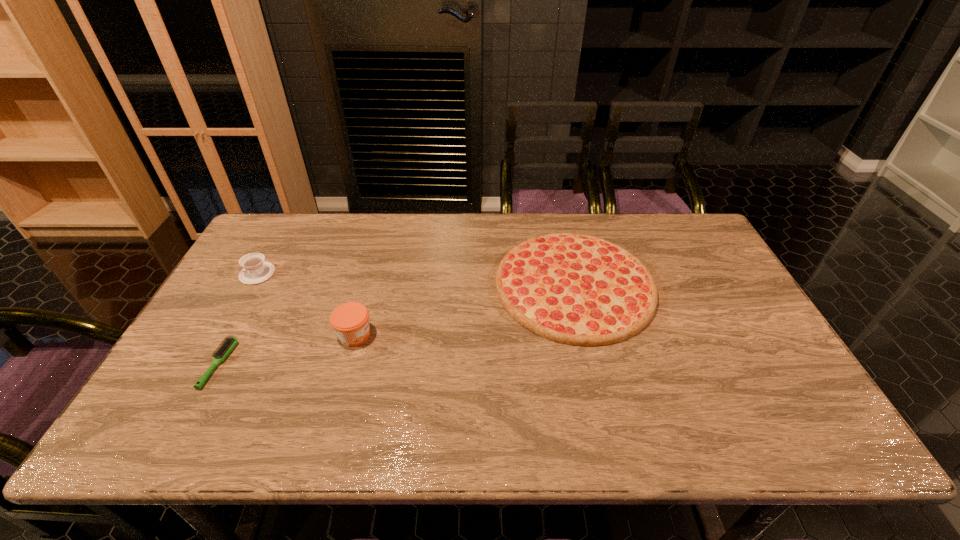
This screenshot has height=540, width=960. Find the location of `vacant position in the image that satisfies the following two spatial constraints: 1. on the handle side of the teacup; 2. on the right side of the shortest object`. vacant position in the image that satisfies the following two spatial constraints: 1. on the handle side of the teacup; 2. on the right side of the shortest object is located at coordinates (206, 364).

This screenshot has width=960, height=540. Find the location of `vacant region that satisfies the following two spatial constraints: 1. on the handle side of the second tallest object; 2. on the right side of the hairbrush`. vacant region that satisfies the following two spatial constraints: 1. on the handle side of the second tallest object; 2. on the right side of the hairbrush is located at coordinates (206, 364).

The height and width of the screenshot is (540, 960). I want to click on vacant space that satisfies the following two spatial constraints: 1. on the handle side of the third shortest object; 2. on the back side of the rightmost object, so click(251, 285).

Where is `vacant region that satisfies the following two spatial constraints: 1. on the handle side of the hairbrush; 2. on the left side of the third shortest object`? vacant region that satisfies the following two spatial constraints: 1. on the handle side of the hairbrush; 2. on the left side of the third shortest object is located at coordinates (206, 364).